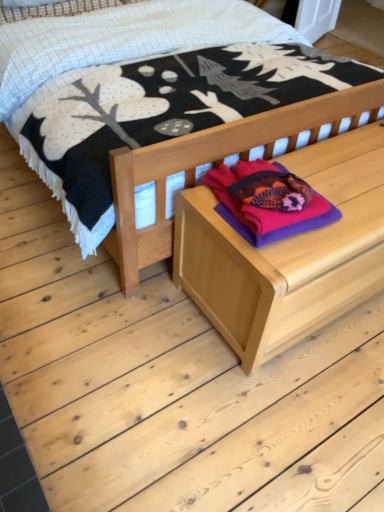
Question: Choose the correct answer: Is natural wood bed at center inside wooden chest at center or outside it?

Choices:
 (A) outside
 (B) inside

Answer: (A)

Question: From a real-world perspective, is natural wood bed at center above or below wooden chest at center?

Choices:
 (A) above
 (B) below

Answer: (A)

Question: Which is farther from the natural wood bed at center?

Choices:
 (A) purple fleece sweater at center
 (B) wooden chest at center

Answer: (A)

Question: Considering the real-world distances, which object is closest to the natural wood bed at center?

Choices:
 (A) wooden chest at center
 (B) purple fleece sweater at center

Answer: (A)